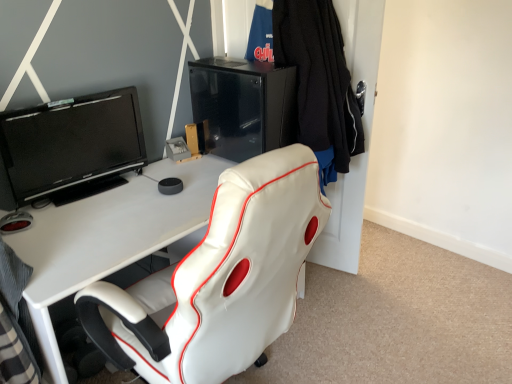
Question: Is black knitted sweater at upper right closer to camera compared to black glossy screen at upper left?

Choices:
 (A) yes
 (B) no

Answer: (B)

Question: Could black glossy screen at upper left be considered to be inside black knitted sweater at upper right?

Choices:
 (A) no
 (B) yes

Answer: (A)

Question: Can you confirm if black knitted sweater at upper right is positioned to the left of black glossy screen at upper left?

Choices:
 (A) no
 (B) yes

Answer: (A)

Question: Can you confirm if black knitted sweater at upper right is shorter than black glossy screen at upper left?

Choices:
 (A) yes
 (B) no

Answer: (B)

Question: Does black knitted sweater at upper right turn towards black glossy screen at upper left?

Choices:
 (A) no
 (B) yes

Answer: (A)

Question: Based on their positions, is black glossy/file cabinet at upper center located to the left or right of black knitted sweater at upper right?

Choices:
 (A) left
 (B) right

Answer: (A)

Question: Is black glossy/file cabinet at upper center situated inside black knitted sweater at upper right or outside?

Choices:
 (A) outside
 (B) inside

Answer: (A)

Question: In terms of size, does black glossy/file cabinet at upper center appear bigger or smaller than black knitted sweater at upper right?

Choices:
 (A) small
 (B) big

Answer: (A)

Question: From their relative heights in the image, would you say black glossy/file cabinet at upper center is taller or shorter than black knitted sweater at upper right?

Choices:
 (A) tall
 (B) short

Answer: (B)

Question: From their relative heights in the image, would you say matte black entertainment center at upper center is taller or shorter than black knitted sweater at upper right?

Choices:
 (A) short
 (B) tall

Answer: (B)

Question: Relative to black knitted sweater at upper right, is matte black entertainment center at upper center in front or behind?

Choices:
 (A) front
 (B) behind

Answer: (A)

Question: Considering the positions of matte black entertainment center at upper center and black knitted sweater at upper right in the image, is matte black entertainment center at upper center wider or thinner than black knitted sweater at upper right?

Choices:
 (A) wide
 (B) thin

Answer: (A)

Question: Considering the positions of matte black entertainment center at upper center and black knitted sweater at upper right in the image, is matte black entertainment center at upper center bigger or smaller than black knitted sweater at upper right?

Choices:
 (A) big
 (B) small

Answer: (A)

Question: Based on their sizes in the image, would you say black glossy screen at upper left is bigger or smaller than black knitted sweater at upper right?

Choices:
 (A) big
 (B) small

Answer: (B)

Question: Considering the positions of black glossy screen at upper left and black knitted sweater at upper right in the image, is black glossy screen at upper left wider or thinner than black knitted sweater at upper right?

Choices:
 (A) thin
 (B) wide

Answer: (A)